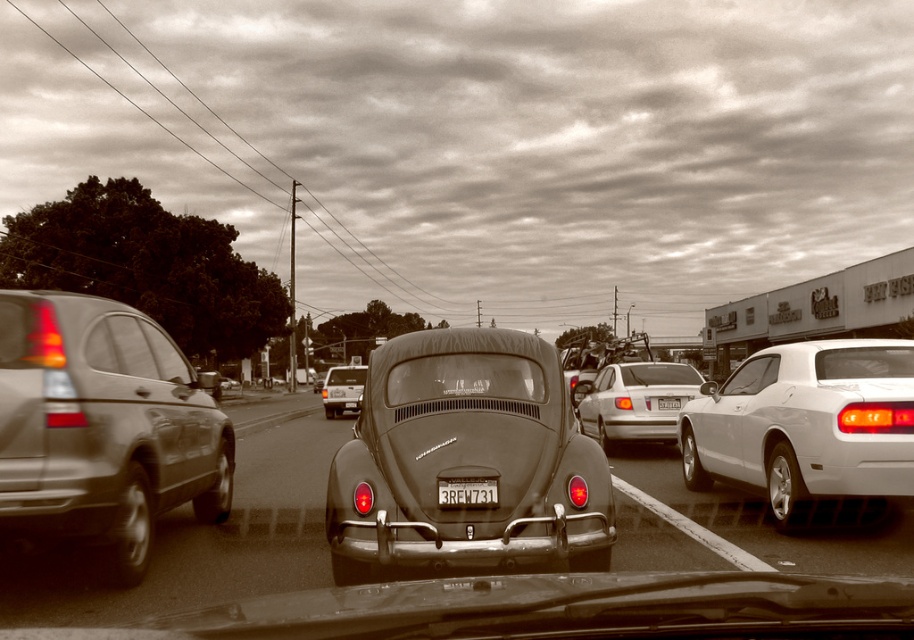
Question: Is metallic gray suv at left thinner than clear glass windshield at center?

Choices:
 (A) yes
 (B) no

Answer: (A)

Question: Among these objects, which one is farthest from the camera?

Choices:
 (A) metallic gray license plate at center
 (B) white glossy car at right
 (C) metallic gray suv at left
 (D) metallic silver van at center

Answer: (D)

Question: Is matte black car at center smaller than metallic silver van at center?

Choices:
 (A) no
 (B) yes

Answer: (B)

Question: Which object is closer to the camera taking this photo?

Choices:
 (A) metallic gray suv at left
 (B) white plastic license plate at rear
 (C) metallic silver sedan at center
 (D) white glossy car at right

Answer: (A)

Question: Is metallic gray suv at left further to camera compared to white glossy car at right?

Choices:
 (A) yes
 (B) no

Answer: (B)

Question: Which object is the closest to the white glossy car at right?

Choices:
 (A) clear glass windshield at center
 (B) matte black car at center
 (C) metallic silver van at center

Answer: (B)